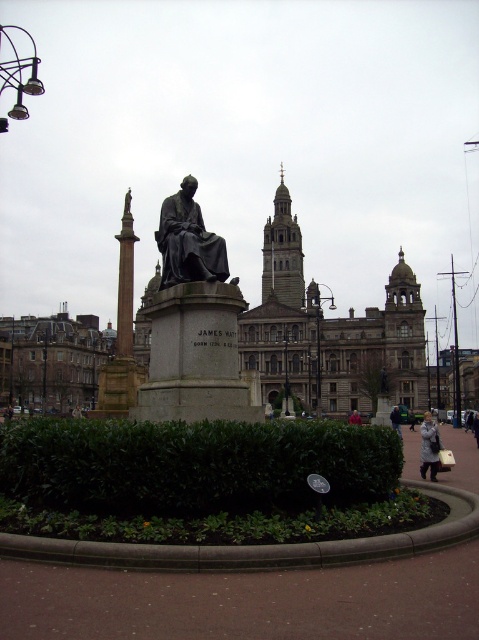
Which is more to the left, green leafy hedge at center or bronze statue at center?

bronze statue at center

Locate an element on the screen. The width and height of the screenshot is (479, 640). green leafy hedge at center is located at coordinates (193, 465).

Between point (218, 499) and point (208, 252), which one is positioned behind?

Point (208, 252)

You are a GUI agent. You are given a task and a screenshot of the screen. Output one action in this format:
    pyautogui.click(x=<x>, y=<y>)
    Task: Click on the green leafy hedge at center
    The height and width of the screenshot is (640, 479).
    Given the screenshot: What is the action you would take?
    pyautogui.click(x=193, y=465)

Is dark gray coat at center wider than light pink fabric coat at lower right?

Yes, dark gray coat at center is wider than light pink fabric coat at lower right.

Where is `dark gray coat at center`? Image resolution: width=479 pixels, height=640 pixels. dark gray coat at center is located at coordinates (476, 428).

You are a GUI agent. You are given a task and a screenshot of the screen. Output one action in this format:
    pyautogui.click(x=<x>, y=<y>)
    Task: Click on the dark gray coat at center
    
    Given the screenshot: What is the action you would take?
    pyautogui.click(x=476, y=428)

Where is `dark gray coat at center`? The image size is (479, 640). dark gray coat at center is located at coordinates pos(476,428).

Does green fabric jacket at lower right have a larger size compared to light pink fabric coat at lower right?

Yes.

Does green fabric jacket at lower right have a greater height compared to light pink fabric coat at lower right?

Yes, green fabric jacket at lower right is taller than light pink fabric coat at lower right.

Who is more distant from viewer, (394, 416) or (356, 417)?

The point (356, 417) is behind.

Where is `green fabric jacket at lower right`? green fabric jacket at lower right is located at coordinates (396, 419).